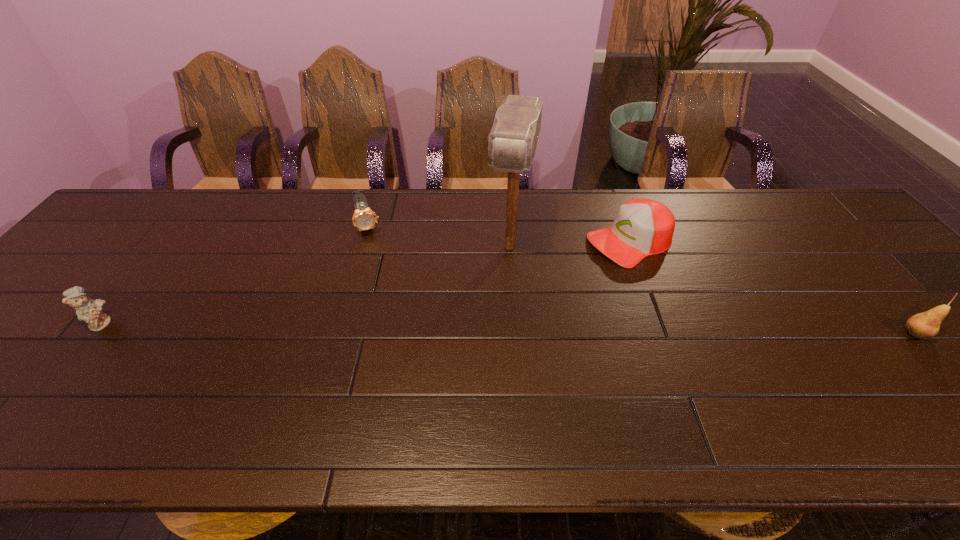
The height and width of the screenshot is (540, 960). I want to click on object that is at the right edge, so click(x=925, y=325).

Where is `vacant area at the far edge`? vacant area at the far edge is located at coordinates point(420,224).

Find the location of a particular element. vacant region at the near edge is located at coordinates (684, 402).

The image size is (960, 540). In order to click on vacant area at the left edge of the desktop in this screenshot , I will do `click(108, 248)`.

Image resolution: width=960 pixels, height=540 pixels. What are the coordinates of `free space at the right edge` in the screenshot? It's located at (896, 273).

Locate an element on the screen. The width and height of the screenshot is (960, 540). free space at the far left corner of the desktop is located at coordinates (139, 193).

Find the location of a particular element. The width and height of the screenshot is (960, 540). free region at the far right corner is located at coordinates (834, 214).

Identify the location of vacant point located between the teddy bear and the fourth object from left to right. This screenshot has height=540, width=960. (366, 282).

I want to click on vacant space that is in between the rightmost object and the teddy bear, so click(x=508, y=328).

This screenshot has height=540, width=960. In order to click on free space between the second object from left to right and the rightmost object in this screenshot , I will do `click(641, 280)`.